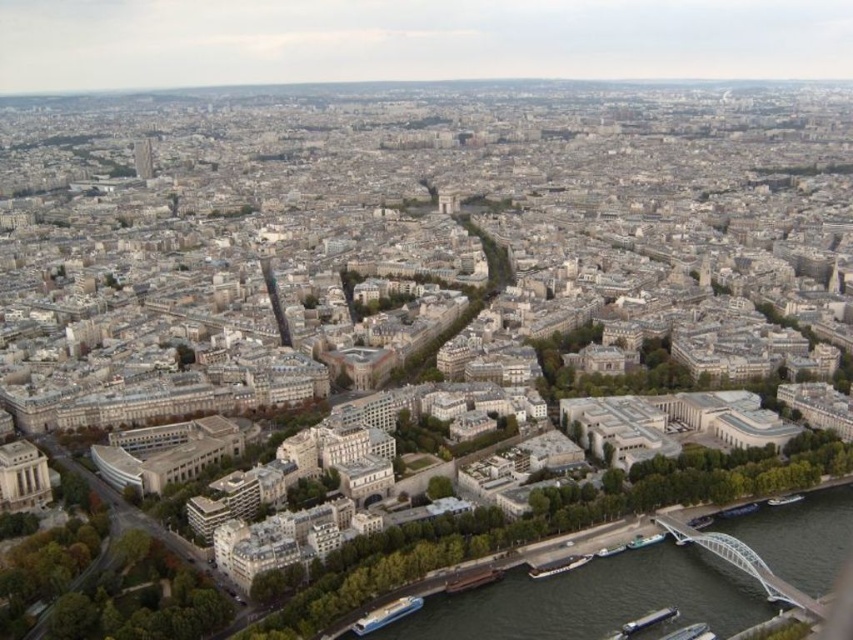
Question: Does dark gray concrete river at lower right come in front of smooth concrete tower at upper left?

Choices:
 (A) yes
 (B) no

Answer: (A)

Question: Which of the following is the closest to the observer?

Choices:
 (A) smooth concrete tower at upper left
 (B) dark gray concrete river at lower right

Answer: (B)

Question: Does dark gray concrete river at lower right appear on the right side of shiny metallic eiffel tower at center?

Choices:
 (A) yes
 (B) no

Answer: (B)

Question: Which point appears closest to the camera in this image?

Choices:
 (A) (692, 529)
 (B) (273, 284)
 (C) (440, 605)

Answer: (C)

Question: Which of the following is the farthest from the observer?

Choices:
 (A) (727, 582)
 (B) (271, 289)

Answer: (B)

Question: Considering the relative positions of dark gray concrete river at lower right and smooth concrete tower at upper left in the image provided, where is dark gray concrete river at lower right located with respect to smooth concrete tower at upper left?

Choices:
 (A) right
 (B) left

Answer: (A)